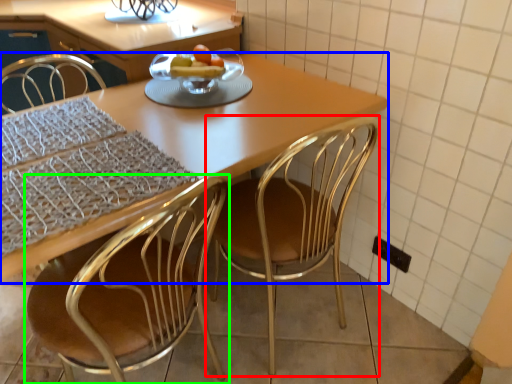
Question: Which object is positioned closest to chair (highlighted by a red box)? Select from kitchen & dining room table (highlighted by a blue box) and chair (highlighted by a green box).

Choices:
 (A) kitchen & dining room table
 (B) chair

Answer: (A)